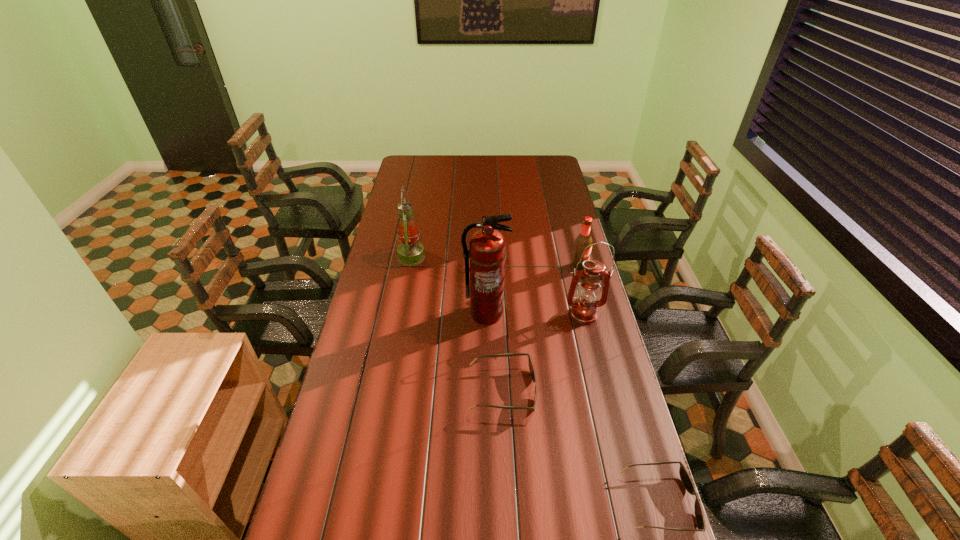
Identify the location of the left sunglasses. The height and width of the screenshot is (540, 960). (531, 367).

I want to click on the taller sunglasses, so click(531, 367).

At what (x,y) coordinates should I click in order to perform the action: click on the nearest object. Please return your answer as a coordinate pair (x, y). Looking at the image, I should click on (684, 475).

This screenshot has width=960, height=540. I want to click on the shortest object, so click(x=684, y=475).

What are the coordinates of `the farther oil lamp` in the screenshot? It's located at (410, 252).

This screenshot has width=960, height=540. Find the location of `the leftmost object`. the leftmost object is located at coordinates (410, 252).

The width and height of the screenshot is (960, 540). Identify the location of beer bottle. (584, 239).

What are the coordinates of `the tallest object` in the screenshot? It's located at (487, 248).

The width and height of the screenshot is (960, 540). I want to click on the nearer oil lamp, so click(584, 309).

Find the location of `free point located 0.170m on the lenses of the farther sunglasses`. free point located 0.170m on the lenses of the farther sunglasses is located at coordinates (x=589, y=390).